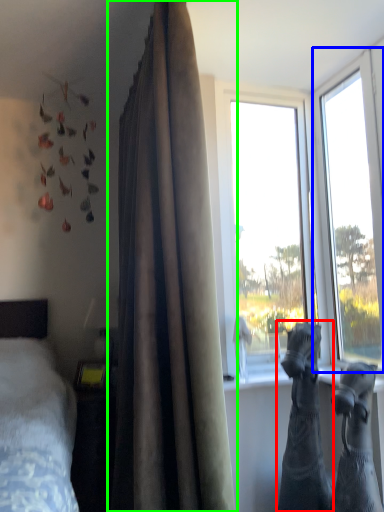
Question: Estimate the real-world distances between objects in this image. Which object is closer to animal (highlighted by a red box), window (highlighted by a blue box) or curtain (highlighted by a green box)?

Choices:
 (A) window
 (B) curtain

Answer: (B)